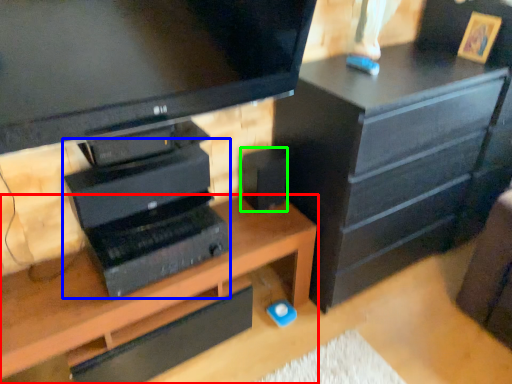
Question: Considering the real-world distances, which object is closest to desk (highlighted by a red box)? computer (highlighted by a blue box) or speaker (highlighted by a green box).

Choices:
 (A) computer
 (B) speaker

Answer: (A)